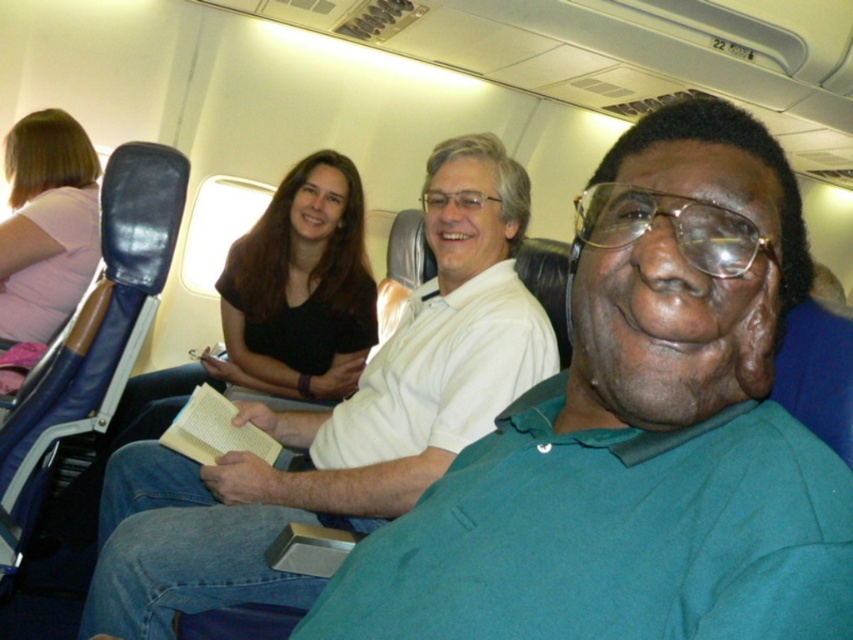
Question: Which of the following is the farthest from the observer?

Choices:
 (A) white matte shirt at center
 (B) green matte shirt at center

Answer: (A)

Question: Is green matte shirt at center above white matte shirt at center?

Choices:
 (A) yes
 (B) no

Answer: (A)

Question: Is green matte shirt at center positioned at the back of white matte shirt at center?

Choices:
 (A) no
 (B) yes

Answer: (A)

Question: Which object appears farthest from the camera in this image?

Choices:
 (A) white matte shirt at center
 (B) green matte shirt at center

Answer: (A)

Question: Considering the relative positions of green matte shirt at center and white matte shirt at center in the image provided, where is green matte shirt at center located with respect to white matte shirt at center?

Choices:
 (A) right
 (B) left

Answer: (A)